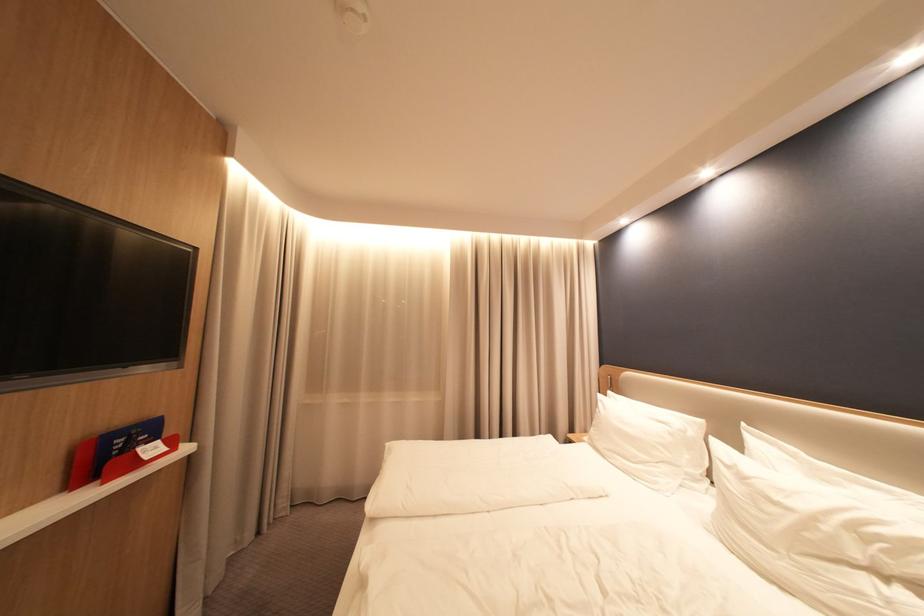
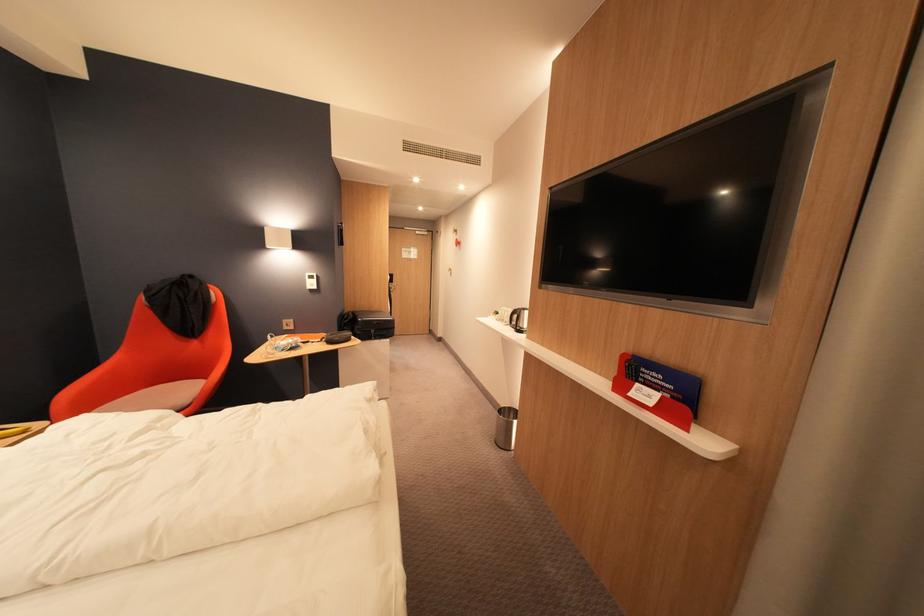
In the second image, find the point that corresponds to point 150,452 in the first image.

(648, 386)